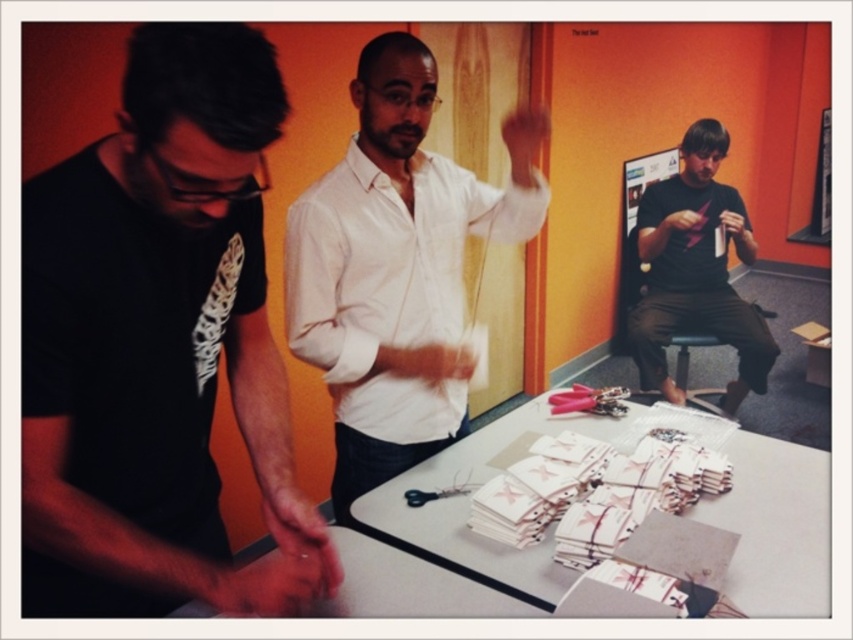
Question: Is white cotton shirt at center closer to the viewer compared to white paper at center?

Choices:
 (A) yes
 (B) no

Answer: (B)

Question: Which of these objects is positioned farthest from the white cotton shirt at center?

Choices:
 (A) matte black shirt at right
 (B) white paper at center

Answer: (A)

Question: Is black matte t-shirt at left to the left of matte black shirt at right from the viewer's perspective?

Choices:
 (A) yes
 (B) no

Answer: (A)

Question: Observing the image, what is the correct spatial positioning of white paper at center in reference to matte black shirt at right?

Choices:
 (A) right
 (B) left

Answer: (B)

Question: Estimate the real-world distances between objects in this image. Which object is closer to the black matte t-shirt at left?

Choices:
 (A) white cotton shirt at center
 (B) white paper at center

Answer: (A)

Question: Estimate the real-world distances between objects in this image. Which object is closer to the black matte t-shirt at left?

Choices:
 (A) white cotton shirt at center
 (B) white paper at center

Answer: (A)